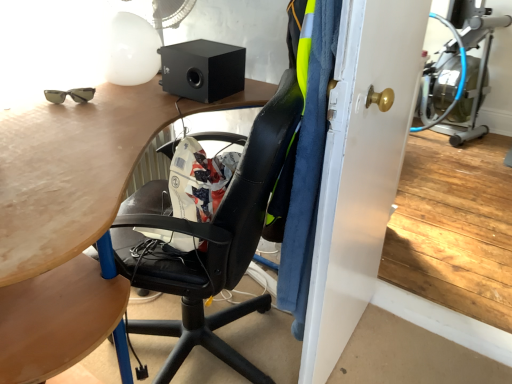
What do you see at coordinates (202, 70) in the screenshot? Image resolution: width=512 pixels, height=384 pixels. I see `black matte speaker at upper center` at bounding box center [202, 70].

The width and height of the screenshot is (512, 384). I want to click on matte gold door handle at center, so [360, 169].

I want to click on black matte speaker at upper center, so click(x=202, y=70).

Is white plastic mechanical fan at upper center touching matte wood desk at center?

No, white plastic mechanical fan at upper center is not making contact with matte wood desk at center.

From a real-world perspective, is white plastic mechanical fan at upper center physically located above or below matte wood desk at center?

Clearly, from a real-world perspective, white plastic mechanical fan at upper center is above matte wood desk at center.

Is white plastic mechanical fan at upper center turned away from matte wood desk at center?

No, matte wood desk at center is not at the back of white plastic mechanical fan at upper center.

Is white plastic mechanical fan at upper center at the left side of matte wood desk at center?

Indeed, white plastic mechanical fan at upper center is positioned on the left side of matte wood desk at center.

Based on the photo, from the image's perspective, is matte gold door handle at center located above or below black matte speaker at upper center?

Clearly, from the image's perspective, matte gold door handle at center is below black matte speaker at upper center.

Is matte gold door handle at center spatially inside black matte speaker at upper center, or outside of it?

matte gold door handle at center is outside black matte speaker at upper center.

Is matte gold door handle at center next to black matte speaker at upper center?

No, matte gold door handle at center is not making contact with black matte speaker at upper center.

In the image, there is a black matte speaker at upper center. Identify the location of glass door below it (from a real-world perspective). (360, 169).

Considering the sizes of objects matte wood desk at center and matte gold door handle at center in the image provided, who is bigger, matte wood desk at center or matte gold door handle at center?

With larger size is matte wood desk at center.

Could matte gold door handle at center be considered to be inside matte wood desk at center?

No, matte gold door handle at center is not surrounded by matte wood desk at center.

Can you confirm if matte wood desk at center is taller than matte gold door handle at center?

No.

From the image's perspective, who appears lower, matte wood desk at center or matte gold door handle at center?

matte wood desk at center appears lower in the image.

Who is smaller, matte wood desk at center or white plastic mechanical fan at upper center?

white plastic mechanical fan at upper center.

Is matte wood desk at center positioned in front of white plastic mechanical fan at upper center?

That is True.

Which is more to the right, matte wood desk at center or white plastic mechanical fan at upper center?

Positioned to the right is matte wood desk at center.

Which is correct: matte wood desk at center is inside white plastic mechanical fan at upper center, or outside of it?

matte wood desk at center is located beyond the bounds of white plastic mechanical fan at upper center.

Is black matte speaker at upper center wider or thinner than matte wood desk at center?

black matte speaker at upper center is thinner than matte wood desk at center.

Who is taller, black matte speaker at upper center or matte wood desk at center?

With more height is matte wood desk at center.

How different are the orientations of black matte speaker at upper center and matte wood desk at center in degrees?

There is a 69.8-degree angle between the facing directions of black matte speaker at upper center and matte wood desk at center.

Visually, is black matte speaker at upper center positioned to the left or to the right of matte wood desk at center?

From the image, it's evident that black matte speaker at upper center is to the right of matte wood desk at center.

Is black matte speaker at upper center aimed at matte gold door handle at center?

No, black matte speaker at upper center is not turned towards matte gold door handle at center.

Is black matte speaker at upper center far from matte gold door handle at center?

black matte speaker at upper center is actually quite close to matte gold door handle at center.

In the image, is black matte speaker at upper center on the left side or the right side of matte gold door handle at center?

black matte speaker at upper center is to the left of matte gold door handle at center.

Which is farther from the camera, [194,69] or [362,174]?

The point [194,69] is behind.

In the scene shown: Can you confirm if black matte speaker at upper center is smaller than white plastic mechanical fan at upper center?

Yes, black matte speaker at upper center is smaller than white plastic mechanical fan at upper center.

Is the surface of black matte speaker at upper center in direct contact with white plastic mechanical fan at upper center?

There is a gap between black matte speaker at upper center and white plastic mechanical fan at upper center.

From the image's perspective, is black matte speaker at upper center above or below white plastic mechanical fan at upper center?

black matte speaker at upper center is situated lower than white plastic mechanical fan at upper center in the image.

Based on the photo, is black matte speaker at upper center aimed at white plastic mechanical fan at upper center?

No, black matte speaker at upper center is not turned towards white plastic mechanical fan at upper center.

Identify the location of desk in front of the white plastic mechanical fan at upper center. (65, 222).

You are a GUI agent. You are given a task and a screenshot of the screen. Output one action in this format:
    pyautogui.click(x=<x>, y=<y>)
    Task: Click on the loudspeaker that is above the matte gold door handle at center (from a real-world perspective)
    
    Given the screenshot: What is the action you would take?
    pyautogui.click(x=202, y=70)

Estimate the real-world distances between objects in this image. Which object is closer to matte gold door handle at center, white plastic mechanical fan at upper center or black matte speaker at upper center?

black matte speaker at upper center lies closer to matte gold door handle at center than the other object.

Estimate the real-world distances between objects in this image. Which object is further from matte wood desk at center, matte gold door handle at center or white plastic mechanical fan at upper center?

Among the two, white plastic mechanical fan at upper center is located further to matte wood desk at center.

Which object lies nearer to the anchor point matte gold door handle at center, matte wood desk at center or white plastic mechanical fan at upper center?

Based on the image, matte wood desk at center appears to be nearer to matte gold door handle at center.

When comparing their distances from matte wood desk at center, does black matte speaker at upper center or matte gold door handle at center seem closer?

Among the two, black matte speaker at upper center is located nearer to matte wood desk at center.

When comparing their distances from matte gold door handle at center, does white plastic mechanical fan at upper center or matte wood desk at center seem closer?

The object closer to matte gold door handle at center is matte wood desk at center.

Looking at the image, which one is located further to white plastic mechanical fan at upper center, black matte speaker at upper center or matte wood desk at center?

The object further to white plastic mechanical fan at upper center is matte wood desk at center.

Which object lies further to the anchor point matte gold door handle at center, matte wood desk at center or black matte speaker at upper center?

black matte speaker at upper center is further to matte gold door handle at center.

Considering their positions, is white plastic mechanical fan at upper center positioned further to black matte speaker at upper center than matte gold door handle at center?

matte gold door handle at center is further to black matte speaker at upper center.

Where is `loudspeaker between matte wood desk at center and white plastic mechanical fan at upper center from front to back`? loudspeaker between matte wood desk at center and white plastic mechanical fan at upper center from front to back is located at coordinates (202, 70).

Where is `glass door positioned between matte wood desk at center and black matte speaker at upper center from near to far`? glass door positioned between matte wood desk at center and black matte speaker at upper center from near to far is located at coordinates (360, 169).

Image resolution: width=512 pixels, height=384 pixels. Identify the location of glass door between matte wood desk at center and white plastic mechanical fan at upper center from front to back. (360, 169).

Identify the location of loudspeaker positioned between matte gold door handle at center and white plastic mechanical fan at upper center from near to far. The image size is (512, 384). (202, 70).